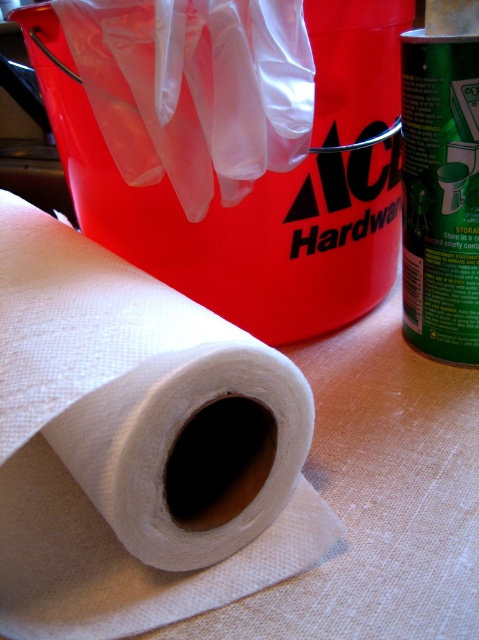
Does white textured paper towel at center have a greater height compared to white fabric roll at center?

Correct, white textured paper towel at center is much taller as white fabric roll at center.

Is white textured paper towel at center below white fabric roll at center?

Yes, white textured paper towel at center is below white fabric roll at center.

Between point (80, 273) and point (112, 52), which one is positioned behind?

The point (112, 52) is more distant.

Image resolution: width=479 pixels, height=640 pixels. I want to click on white textured paper towel at center, so click(129, 384).